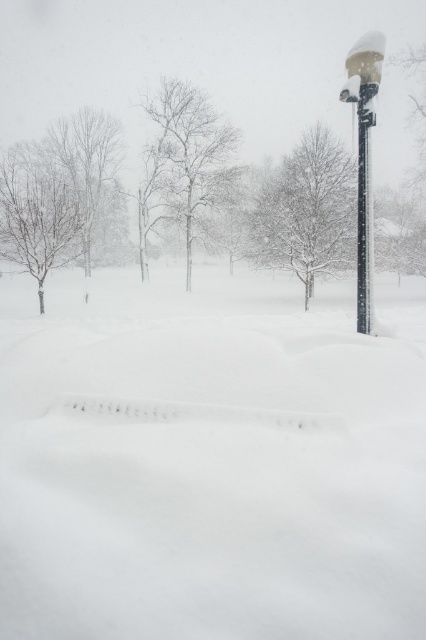
Question: In this image, where is white glossy lamp post at upper right located relative to black plastic pole at upper right?

Choices:
 (A) right
 (B) left

Answer: (A)

Question: Which of the following is the farthest from the observer?

Choices:
 (A) (359, 236)
 (B) (115, 140)
 (C) (232, 138)
 (D) (74, 220)

Answer: (B)

Question: Which of the following is the farthest from the observer?

Choices:
 (A) white snow-covered tree at upper right
 (B) snow-covered branches at center

Answer: (A)

Question: Which is farther from the brown leafless tree at left?

Choices:
 (A) black plastic pole at upper right
 (B) white fluffy snow at center
 (C) white glossy lamp post at upper right

Answer: (A)

Question: Does brown leafless tree at left have a greater width compared to white glossy lamp post at upper right?

Choices:
 (A) yes
 (B) no

Answer: (A)

Question: Can you confirm if brown leafless tree at left is positioned to the left of snow-covered branches at center?

Choices:
 (A) no
 (B) yes

Answer: (B)